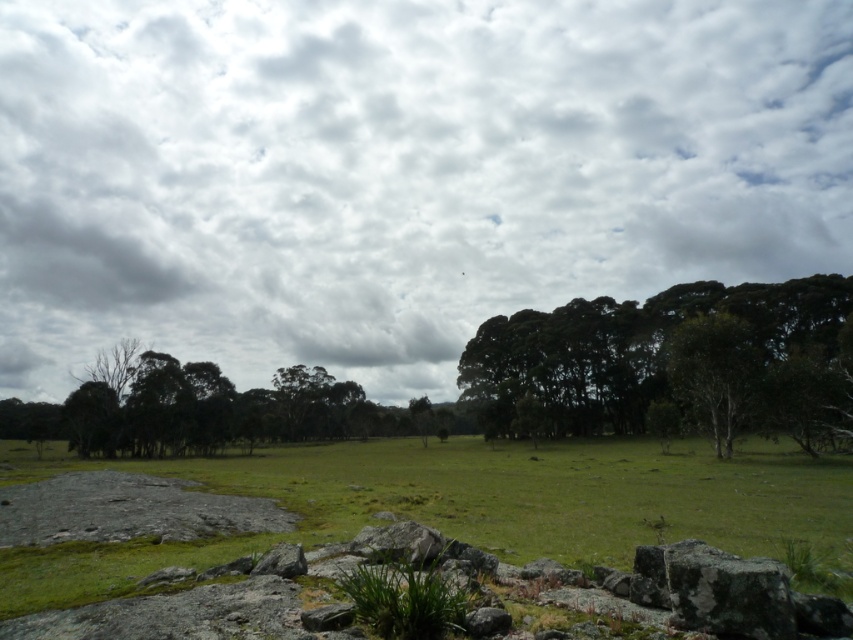
Does green grassy pasture at center have a smaller size compared to green leafy tree at center?

No.

Find the location of a particular element. The height and width of the screenshot is (640, 853). green grassy pasture at center is located at coordinates pos(405,518).

Is point (270, 595) behind point (711, 397)?

No, it is not.

Image resolution: width=853 pixels, height=640 pixels. What are the coordinates of `green grassy pasture at center` in the screenshot? It's located at (405, 518).

Which is more to the left, green grassy pasture at center or gray rough rock at lower left?

Positioned to the left is green grassy pasture at center.

Which is behind, point (190, 563) or point (282, 561)?

Point (190, 563)

Find the location of a particular element. green grassy pasture at center is located at coordinates pos(405,518).

Between point (439, 342) and point (370, 532), which one is positioned behind?

The point (439, 342) is behind.

Does point (654, 214) come behind point (363, 528)?

That is True.

Identify the location of cloudy sky at upper center. (397, 172).